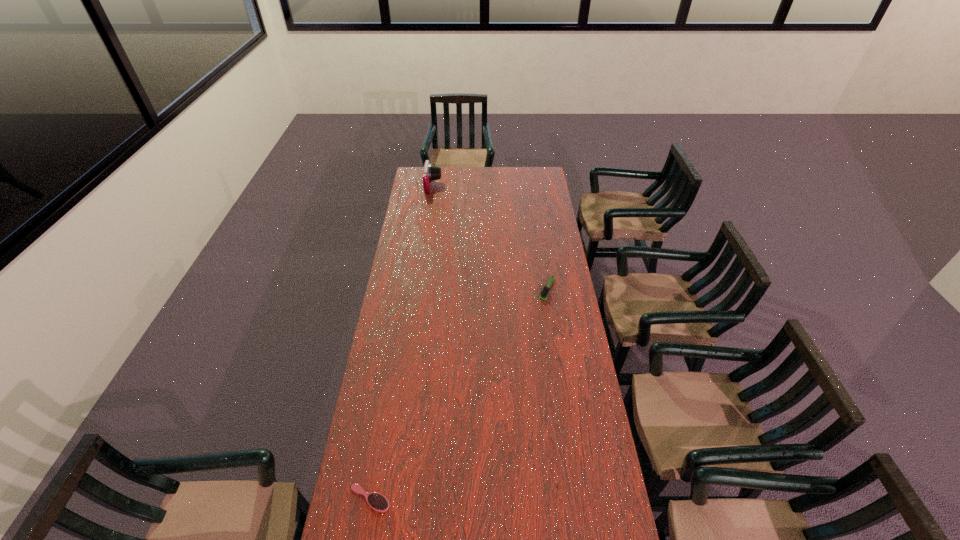
Identify the location of camera that is at the left edge. Image resolution: width=960 pixels, height=540 pixels. (431, 172).

I want to click on hairbrush that is at the left edge, so coord(378,502).

I want to click on object that is at the right edge, so click(x=545, y=291).

Locate an element on the screen. The image size is (960, 540). object that is positioned at the far left corner is located at coordinates (431, 172).

Identify the location of free spot at the left edge of the desktop. (401, 264).

I want to click on free space at the right edge of the desktop, so click(x=566, y=356).

This screenshot has height=540, width=960. Identify the location of empty space that is in between the farther hairbrush and the shortest object. (458, 394).

The width and height of the screenshot is (960, 540). Find the location of `free space between the nearest object and the right hairbrush`. free space between the nearest object and the right hairbrush is located at coordinates (458, 394).

Locate an element on the screen. The image size is (960, 540). free spot between the nearest object and the second shortest object is located at coordinates (458, 394).

Identify the location of vacant point located between the rightmost object and the farthest object. (490, 238).